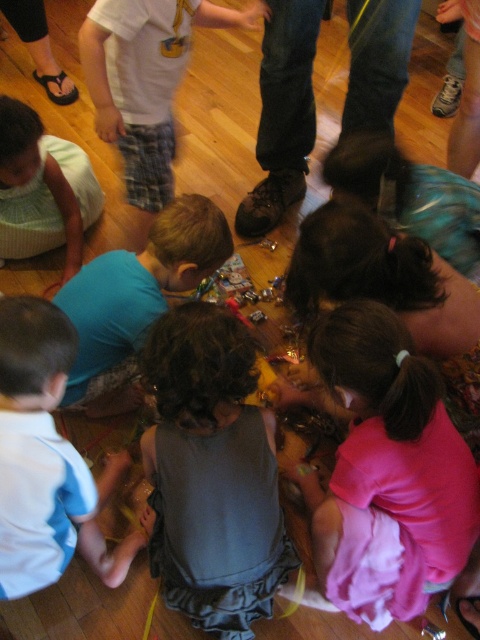
Question: Which of the following is the farthest from the observer?

Choices:
 (A) (32, 497)
 (B) (336, 356)
 (C) (193, 556)

Answer: (C)

Question: Which point is farther to the camera?

Choices:
 (A) gray fabric dress at center
 (B) pink fabric at lower center

Answer: (B)

Question: Does gray fabric dress at center have a lesser width compared to pink fabric at lower center?

Choices:
 (A) no
 (B) yes

Answer: (B)

Question: Where is pink fabric at lower center located in relation to white cotton shirt at lower left in the image?

Choices:
 (A) right
 (B) left

Answer: (A)

Question: Which of these objects is positioned closest to the gray fabric dress at center?

Choices:
 (A) pink fabric at lower center
 (B) white cotton shirt at lower left

Answer: (A)

Question: Is pink fabric at lower center thinner than white cotton shirt at lower left?

Choices:
 (A) no
 (B) yes

Answer: (A)